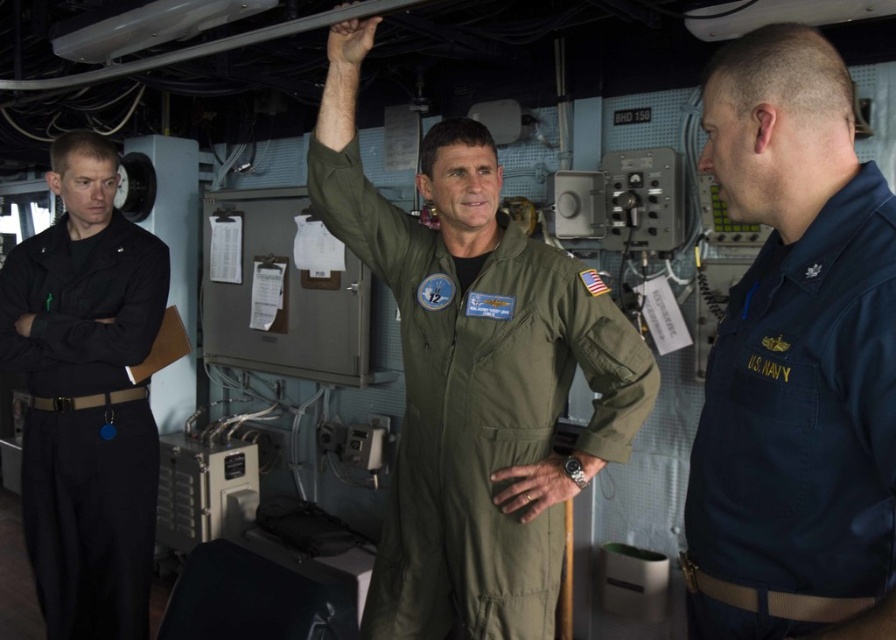
You are a photographer positioned at the center of the scene. You want to take a closeup shot of the navy blue fabric us navy uniform at right without moving your camera. Can you do it based on the distance provided?

The navy blue fabric us navy uniform at right is 30.62 inches away from the viewer. Since this distance is relatively close, you can take a closeup shot without moving your camera.

You are a new recruit on a U.S. Navy ship and need to locate the olive green fabric jumpsuit at center and the black cotton pants at left. From the perspective of someone facing the scene, which item is positioned to the right of the other?

The olive green fabric jumpsuit at center is positioned to the right of the black cotton pants at left.